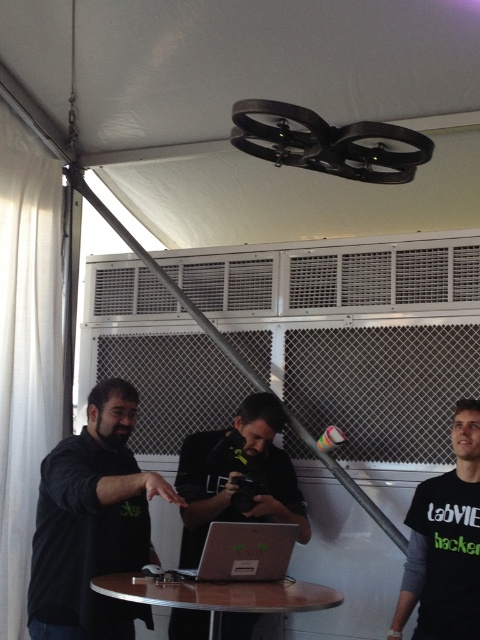
Question: Is black matte shirt at left smaller than silver metallic laptop at center?

Choices:
 (A) no
 (B) yes

Answer: (A)

Question: Can you confirm if black matte shirt at left is positioned to the right of black matte shirt at lower right?

Choices:
 (A) no
 (B) yes

Answer: (A)

Question: Which point is closer to the camera taking this photo?

Choices:
 (A) (52, 342)
 (B) (415, 579)
 (C) (266, 548)

Answer: (C)

Question: Which is nearer to the black matte camera at center?

Choices:
 (A) white fabric curtain at left
 (B) silver metallic laptop at center

Answer: (B)

Question: Which object appears closest to the camera in this image?

Choices:
 (A) silver metallic laptop at center
 (B) metallic round table at center
 (C) black matte camera at center

Answer: (B)

Question: Is black matte shirt at lower right to the right of silver metallic laptop at center from the viewer's perspective?

Choices:
 (A) no
 (B) yes

Answer: (B)